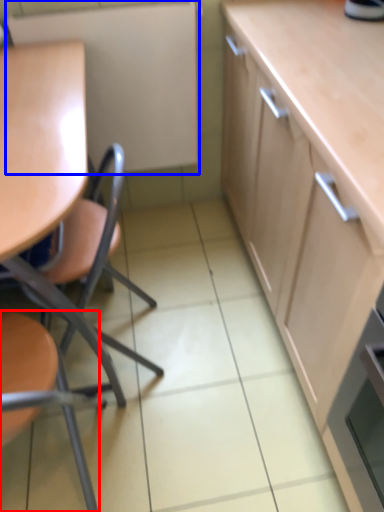
Question: Which object appears closest to the camera in this image, chair (highlighted by a red box) or appliance (highlighted by a blue box)?

Choices:
 (A) chair
 (B) appliance

Answer: (A)